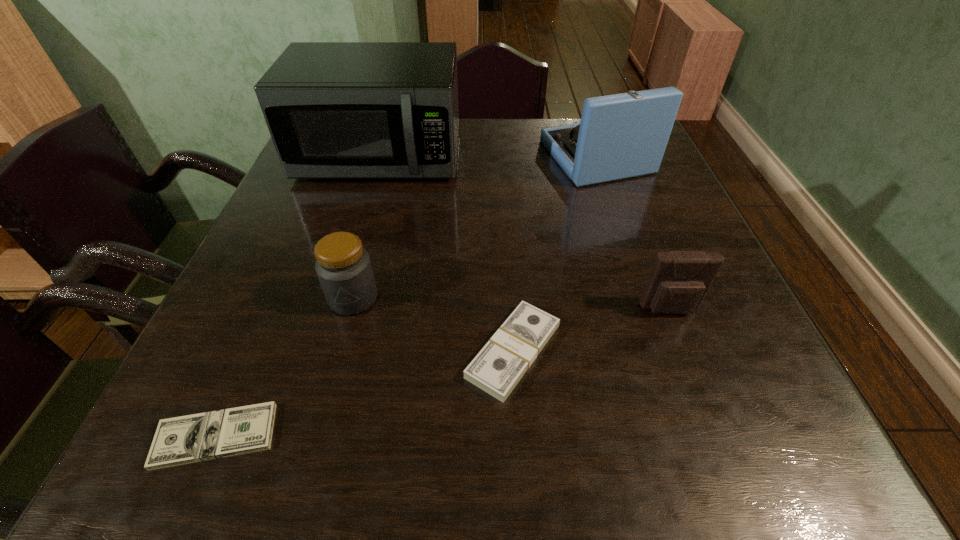
Locate an element on the screen. The image size is (960, 540). blank space located 0.250m on the surface of the jar near the warning symbol is located at coordinates (312, 454).

Where is `vacant region located 0.260m with an open flap on the pouch`? vacant region located 0.260m with an open flap on the pouch is located at coordinates (730, 465).

In order to click on free spot located 0.340m on the right of the fourth object from left to right in this screenshot , I will do `click(762, 351)`.

This screenshot has height=540, width=960. Find the location of `vacant point located 0.160m on the back of the nearest object`. vacant point located 0.160m on the back of the nearest object is located at coordinates (264, 323).

Identify the location of microwave oven that is at the far edge. (335, 110).

Where is `phonograph record situated at the far edge`? phonograph record situated at the far edge is located at coordinates pyautogui.click(x=620, y=136).

Locate an element on the screen. This screenshot has width=960, height=540. object that is positioned at the near edge is located at coordinates (193, 438).

The height and width of the screenshot is (540, 960). I want to click on microwave oven that is positioned at the left edge, so click(x=335, y=110).

Identify the location of dollar that is positioned at the left edge. (193, 438).

Find the location of a particular element. This screenshot has width=960, height=540. phonograph record that is positioned at the right edge is located at coordinates (620, 136).